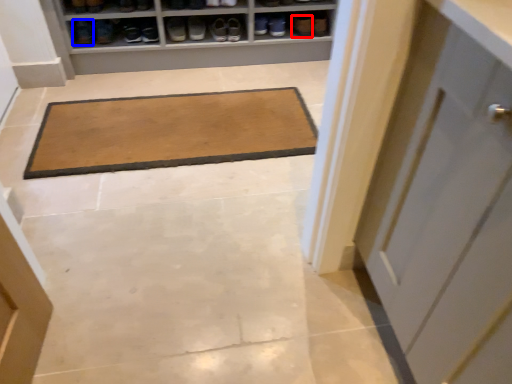
Question: Which object appears farthest to the camera in this image, shoe (highlighted by a red box) or footwear (highlighted by a blue box)?

Choices:
 (A) shoe
 (B) footwear

Answer: (A)